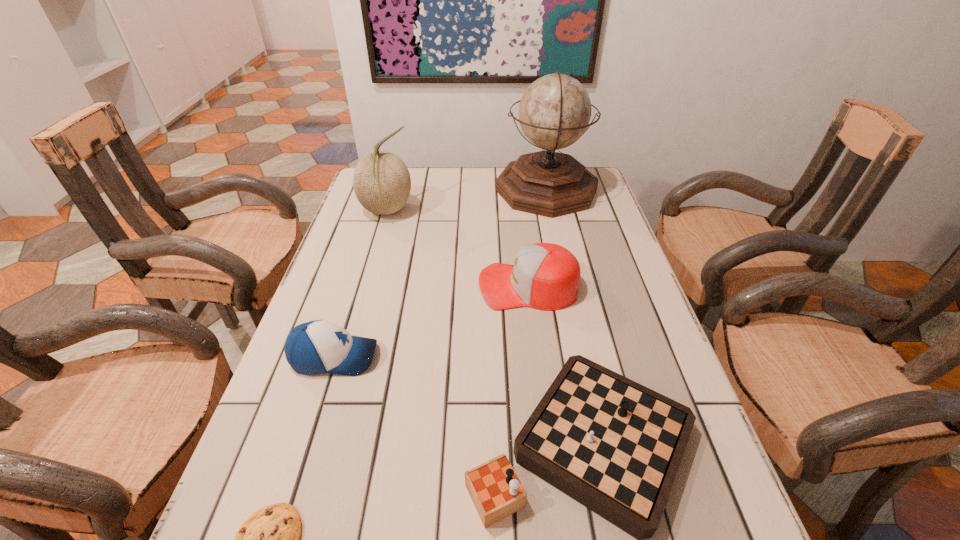
You are a GUI agent. You are given a task and a screenshot of the screen. Output one action in this format:
    pyautogui.click(x=<x>, y=<y>)
    Task: Click on the tallest object
    
    Given the screenshot: What is the action you would take?
    pyautogui.click(x=554, y=112)

Where is `cantaloup`? cantaloup is located at coordinates (381, 180).

Where is `the right baseball cap`? This screenshot has height=540, width=960. the right baseball cap is located at coordinates (545, 276).

At what (x,y) coordinates should I click in order to perform the action: click on the fourth nearest object. Please return your answer as a coordinate pair (x, y). This screenshot has height=540, width=960. Looking at the image, I should click on (545, 276).

At what (x,y) coordinates should I click in order to perform the action: click on the nearer baseball cap. Please return your answer as a coordinate pair (x, y). Looking at the image, I should click on pyautogui.click(x=319, y=346).

Locate an element on the screen. The width and height of the screenshot is (960, 540). the shorter baseball cap is located at coordinates (319, 346).

Find the location of a particular element. vacant space located on the surface of the tallest object is located at coordinates (426, 190).

Identify the location of vacant area located on the surface of the tallest object. (436, 190).

Where is `vacant point located 0.200m on the surface of the tallest object`? This screenshot has height=540, width=960. vacant point located 0.200m on the surface of the tallest object is located at coordinates (436, 190).

Find the location of a particular element. The height and width of the screenshot is (540, 960). vacant space situated 0.180m on the back of the fifth shortest object is located at coordinates (398, 170).